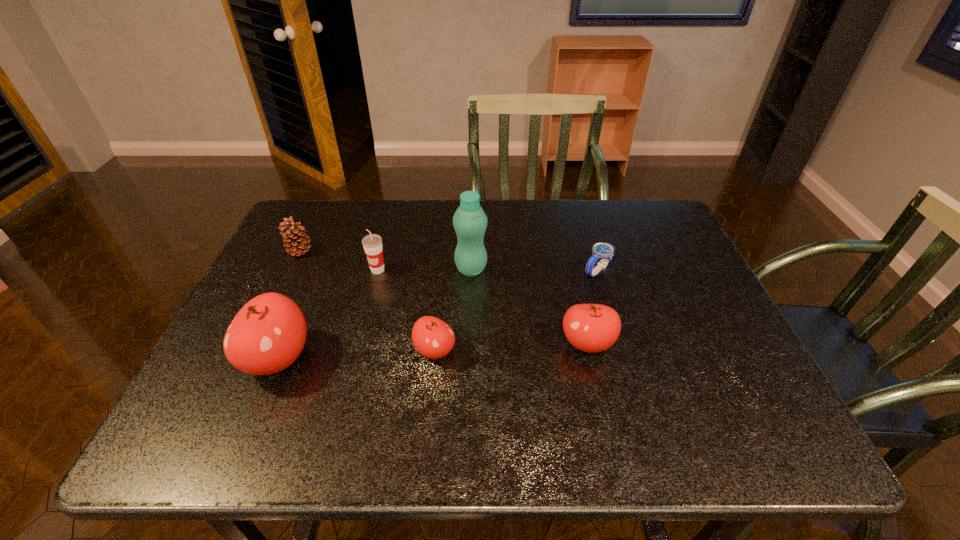
Where is `the leftmost apple`? The width and height of the screenshot is (960, 540). the leftmost apple is located at coordinates (267, 335).

Where is `the tallest apple`? The height and width of the screenshot is (540, 960). the tallest apple is located at coordinates (267, 335).

Find the location of `the sixth tallest object`. the sixth tallest object is located at coordinates (433, 338).

Where is `the second apple from right to left`? the second apple from right to left is located at coordinates (433, 338).

I want to click on the rightmost apple, so click(x=592, y=328).

Image resolution: width=960 pixels, height=540 pixels. What are the coordinates of `pinecone` in the screenshot? It's located at (295, 235).

The height and width of the screenshot is (540, 960). I want to click on bottle, so click(470, 222).

What are the coordinates of `watch` in the screenshot? It's located at (600, 250).

Identify the location of the fifth object from right to left. Image resolution: width=960 pixels, height=540 pixels. (372, 243).

Image resolution: width=960 pixels, height=540 pixels. Find the location of `free space located 0.090m on the back of the leftmost apple`. free space located 0.090m on the back of the leftmost apple is located at coordinates (301, 302).